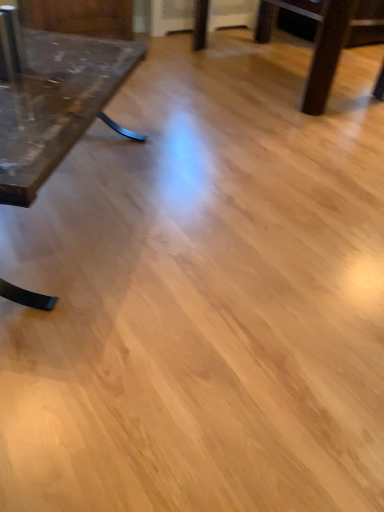
In order to face matte glass table at left, should I rotate leftwards or rightwards?

To align with it, rotate left about 22.273°.

Image resolution: width=384 pixels, height=512 pixels. I want to click on matte glass table at left, so click(56, 105).

Describe the element at coordinates (56, 105) in the screenshot. The height and width of the screenshot is (512, 384). I see `matte glass table at left` at that location.

At what (x,y) coordinates should I click in order to perform the action: click on matte glass table at left. Please return your answer as a coordinate pair (x, y). This screenshot has width=384, height=512. Looking at the image, I should click on (56, 105).